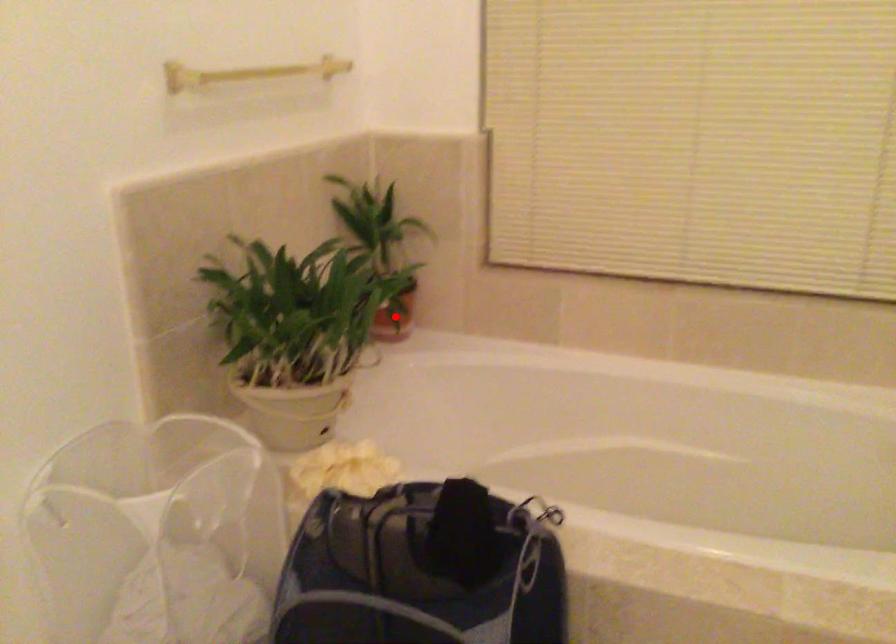
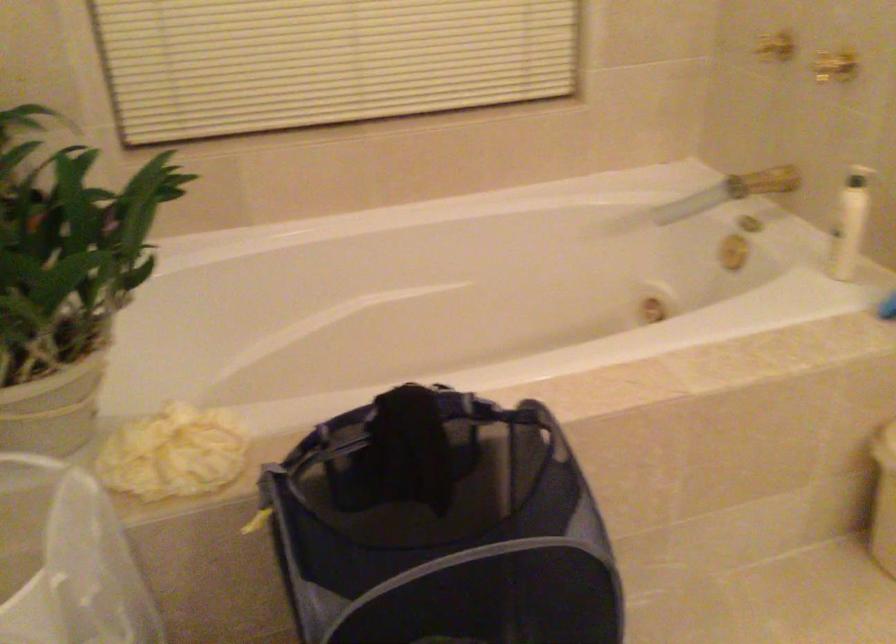
Question: I am providing you with two images of the same scene from different viewpoints. A red point is marked on the first image. Can you still see the location of the red point in image 2?

Choices:
 (A) Yes
 (B) No

Answer: (B)